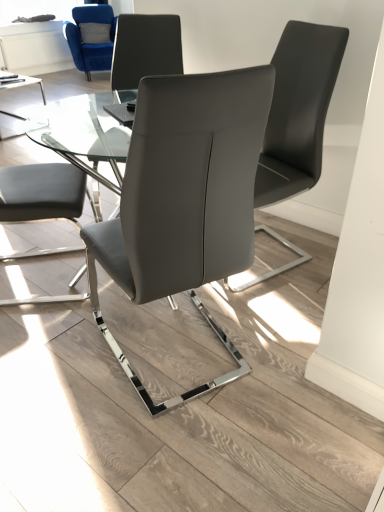
The height and width of the screenshot is (512, 384). Find the location of `vacant region below matte gray chair at center, placed as the first chair when sorted from bottom to top (from a real-world perspective)`. vacant region below matte gray chair at center, placed as the first chair when sorted from bottom to top (from a real-world perspective) is located at coordinates (194, 356).